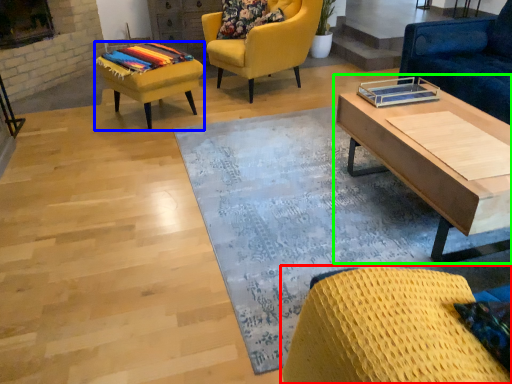
Question: Which is nearer to the chair (highlighted by a red box)? stool (highlighted by a blue box) or coffee table (highlighted by a green box).

Choices:
 (A) stool
 (B) coffee table

Answer: (B)